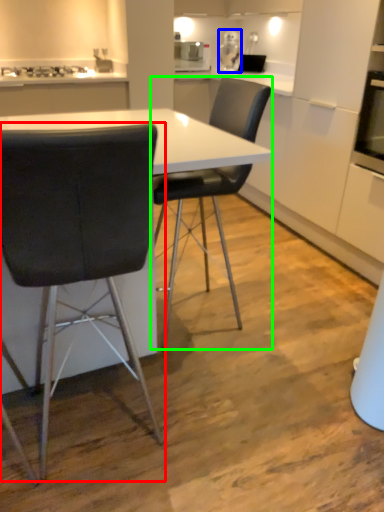
Question: Which object is positioned farthest from chair (highlighted by a red box)? Select from appliance (highlighted by a blue box) and chair (highlighted by a green box).

Choices:
 (A) appliance
 (B) chair

Answer: (A)